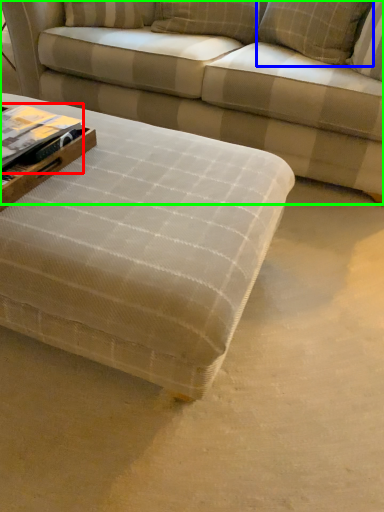
Question: Which object is the farthest from book (highlighted by a red box)? Choose among these: pillow (highlighted by a blue box) or studio couch (highlighted by a green box).

Choices:
 (A) pillow
 (B) studio couch

Answer: (A)